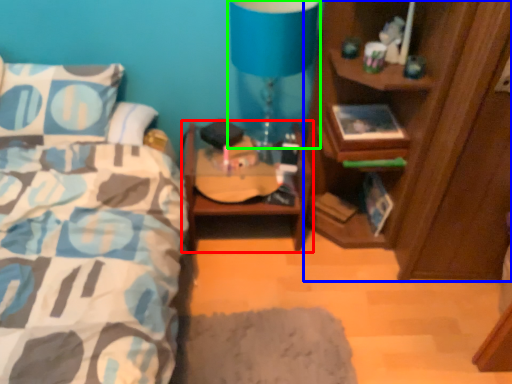
Question: Which object is positioned farthest from nightstand (highlighted by a red box)? Select from cabinetry (highlighted by a blue box) and table lamp (highlighted by a green box).

Choices:
 (A) cabinetry
 (B) table lamp

Answer: (B)